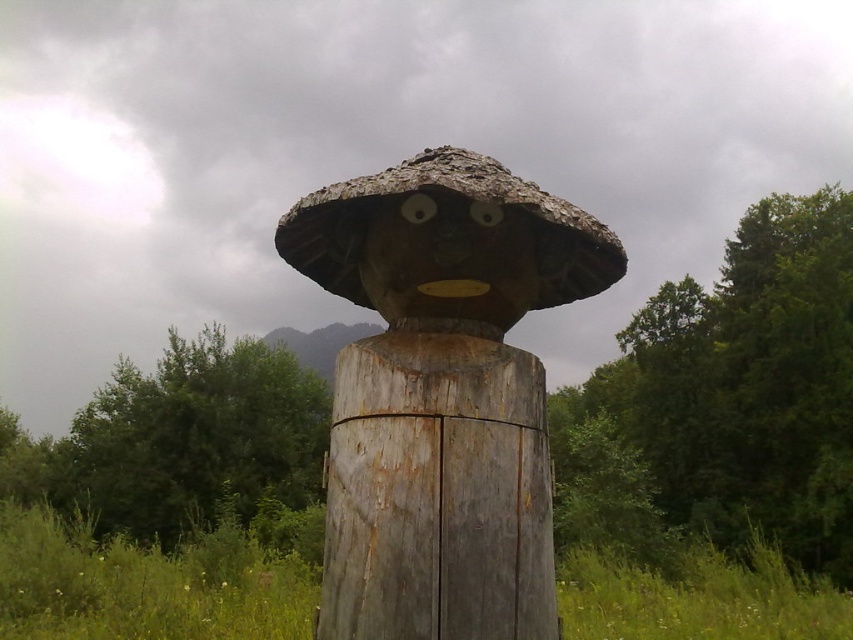
You are standing in the grassy area surrounded by trees and see the rusty wood totem at center and the wooden sculpture at center. Which one is positioned to the left?

The rusty wood totem at center is positioned to the left of the wooden sculpture at center.

You are a painter who wants to paint both the rusty wood totem at center and the weathered wood post at center. Which one do you need to use a longer ladder to reach the top?

The rusty wood totem at center has a greater height compared to the weathered wood post at center, so you need to use a longer ladder to reach the top of the rusty wood totem at center.

You are standing in the grassy area surrounded by trees and see the rusty wood totem at center and the weathered wood post at center. Which object is closer to you?

The rusty wood totem at center is closer to you because it is in front of the weathered wood post at center.